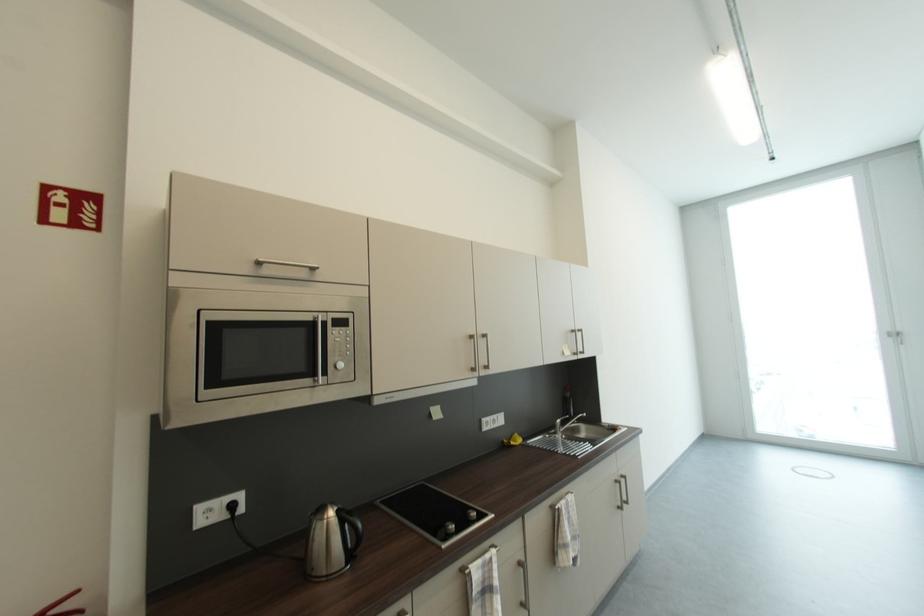
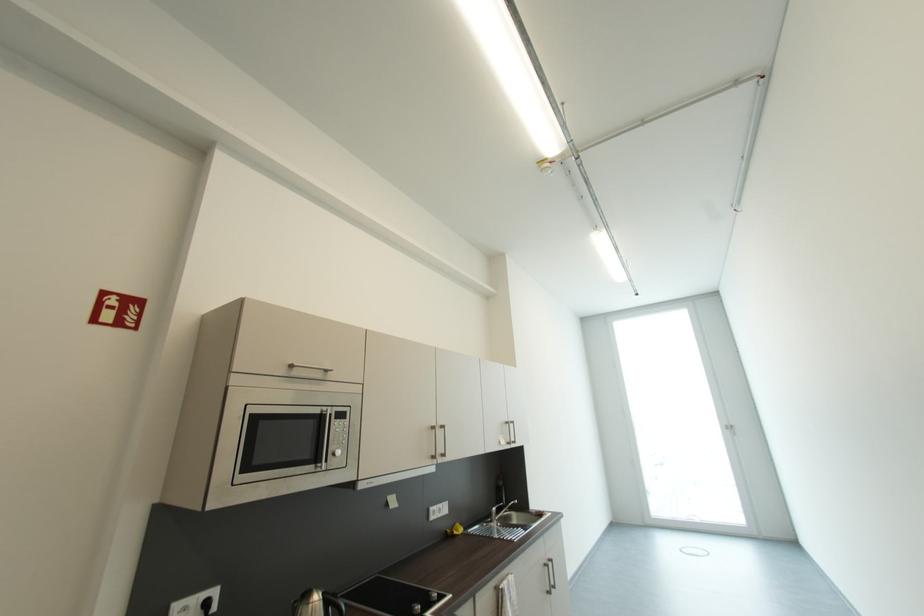
Find the pixel in the second image that matches (x=579, y=331) in the first image.

(513, 424)